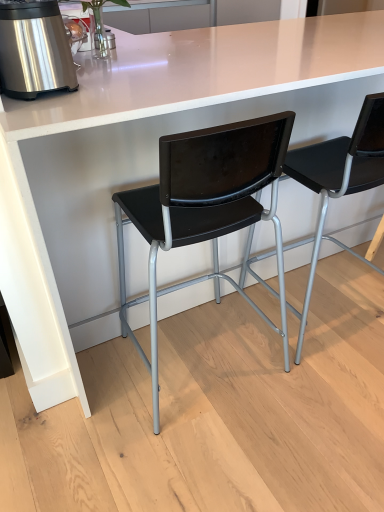
At what (x,y) coordinates should I click in order to perform the action: click on vacant space in front of black plastic chair at center, which is counted as the 2th chair, starting from the right. Please return your answer as a coordinate pair (x, y). This screenshot has width=384, height=512. Looking at the image, I should click on (194, 458).